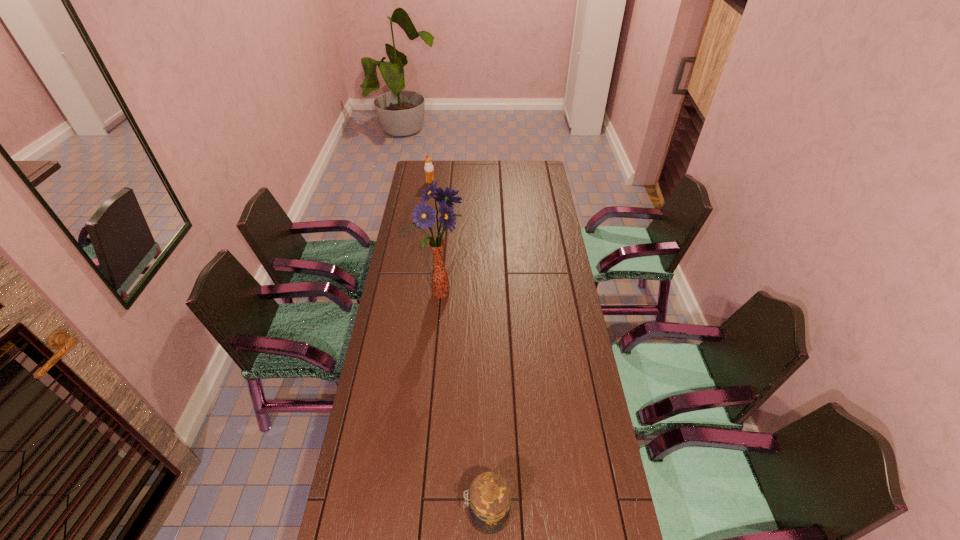
Locate an element on the screen. flower arrangement is located at coordinates (423, 215).

The width and height of the screenshot is (960, 540). I want to click on the second nearest object, so coord(423,215).

Locate an element on the screen. This screenshot has height=540, width=960. the farthest object is located at coordinates click(x=428, y=168).

Where is `jar`? The image size is (960, 540). jar is located at coordinates (489, 507).

This screenshot has height=540, width=960. Find the location of `the rightmost object`. the rightmost object is located at coordinates (489, 507).

This screenshot has height=540, width=960. What are the coordinates of `free spot located on the right of the second nearest object` in the screenshot? It's located at (534, 295).

Where is `vacant area located at the front with a straw on the icecream`? This screenshot has height=540, width=960. vacant area located at the front with a straw on the icecream is located at coordinates (450, 182).

Identify the location of free space located 0.180m on the lid of the nearest object. Image resolution: width=960 pixels, height=540 pixels. (397, 514).

Where is `vacant space located on the lid of the nearest object`? The image size is (960, 540). vacant space located on the lid of the nearest object is located at coordinates click(x=383, y=514).

Locate an element on the screen. The image size is (960, 540). free space located 0.270m on the lid of the nearest object is located at coordinates (364, 514).